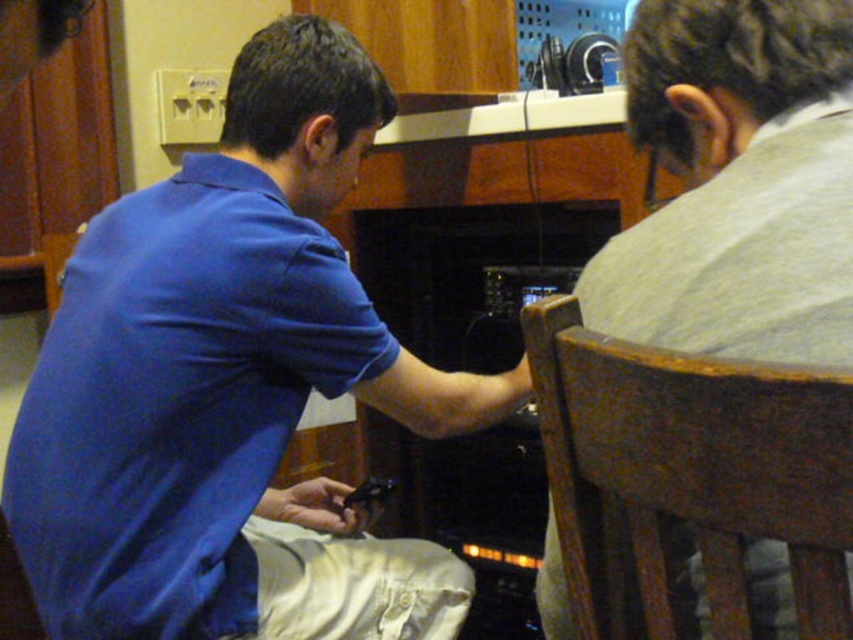
Consider the image. You are standing in front of the scene and want to reach the point at coordinates (x=109, y=410). The wooden chair in the foreground is blocking your path. If the chair is 1.2 meters wide, can you walk around it to reach the point?

The point at coordinates (x=109, y=410) is 98.89 centimeters away from the camera. Since the chair is 1.2 meters wide, you would need to navigate around it. However, the distance to the point is shorter than the chair width, making it difficult to maneuver around the chair and reach the point without moving the chair first.

From the picture: You are standing in the room and want to hand a document to the person wearing the blue cotton shirt at center. The brown wood chair at right is blocking your path. Can you walk around the chair to reach the person?

The blue cotton shirt at center is to the left of the brown wood chair at right, so you can walk around the chair on the right side to reach the person wearing the blue cotton shirt at center.

You are a photographer setting up a shoot in this room. You need to ensure that the blue cotton shirt at center and the brown wood chair at right are both visible in the frame. Given their sizes, which object should you position closer to the camera to maintain their visibility?

The blue cotton shirt at center is larger than the brown wood chair at right. To maintain visibility of both objects, you should position the brown wood chair at right closer to the camera since it is smaller and might otherwise appear too small in the frame compared to the larger shirt.